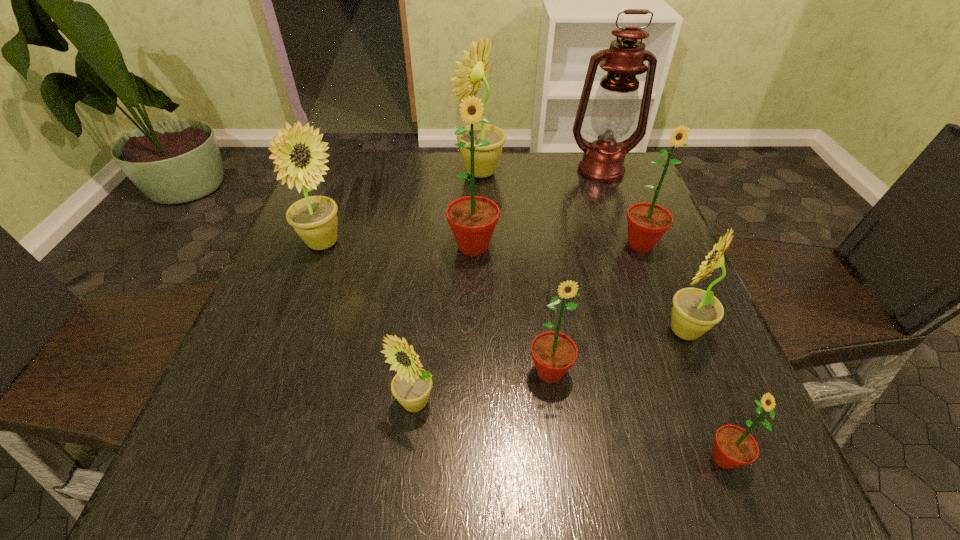
Where is `the third biggest green sunflower`? the third biggest green sunflower is located at coordinates (553, 353).

Locate an element on the screen. The height and width of the screenshot is (540, 960). the nearest object is located at coordinates (734, 446).

Find the location of a particular element. the nearest green sunflower is located at coordinates (734, 446).

Where is `the smallest yellow sunflower`? the smallest yellow sunflower is located at coordinates (411, 386).

The image size is (960, 540). I want to click on the second yellow sunflower from left to right, so click(411, 386).

Find the location of a particular element. This screenshot has width=960, height=540. vacant space located 0.180m on the front of the red oil lamp is located at coordinates (620, 225).

At what (x,y) coordinates should I click in order to perform the action: click on free point located 0.170m on the face of the farthest yellow sunflower. Please return your answer as a coordinate pair (x, y). Looking at the image, I should click on (396, 172).

At what (x,y) coordinates should I click in order to perform the action: click on free space located 0.070m on the face of the farthest yellow sunflower. Please return your answer as a coordinate pair (x, y). This screenshot has width=960, height=540. Looking at the image, I should click on (432, 172).

Locate an element on the screen. The width and height of the screenshot is (960, 540). vacant region located 0.340m on the face of the farthest yellow sunflower is located at coordinates (336, 172).

Where is `free region located 0.220m on the face of the biggest green sunflower`? free region located 0.220m on the face of the biggest green sunflower is located at coordinates (471, 344).